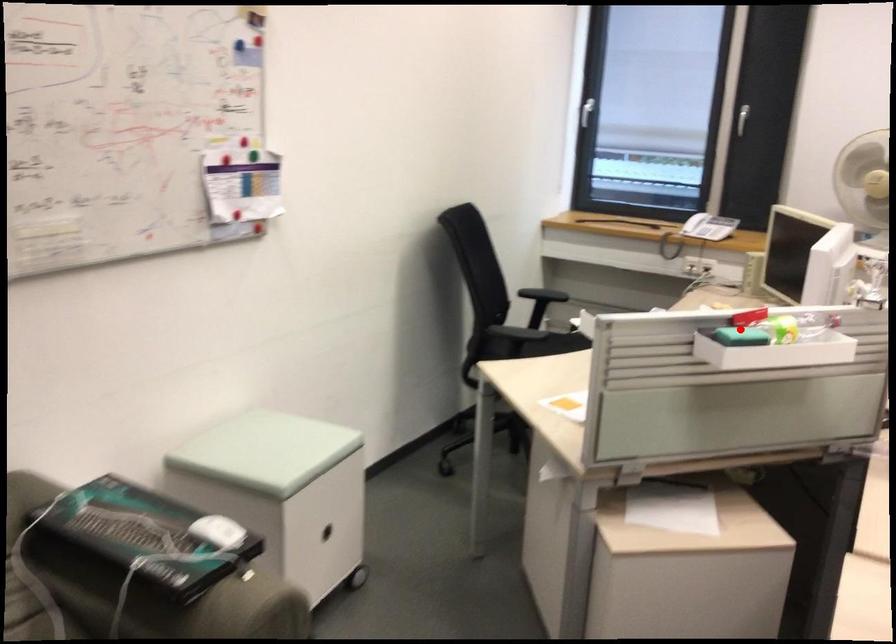
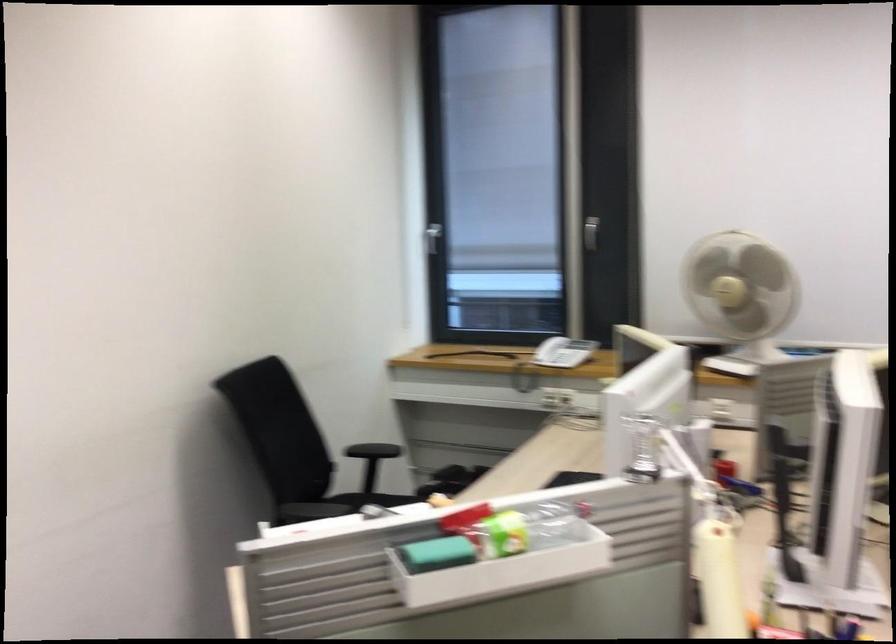
Question: I am providing you with two images of the same scene from different viewpoints. In image1, a red point is highlighted. Considering the same 3D point in image2, which of the following is correct?

Choices:
 (A) It is closer
 (B) It is farther

Answer: (A)